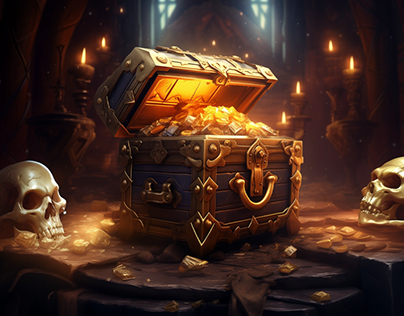
What are the coordinates of `treasure trunk` in the screenshot? It's located at (223, 206).